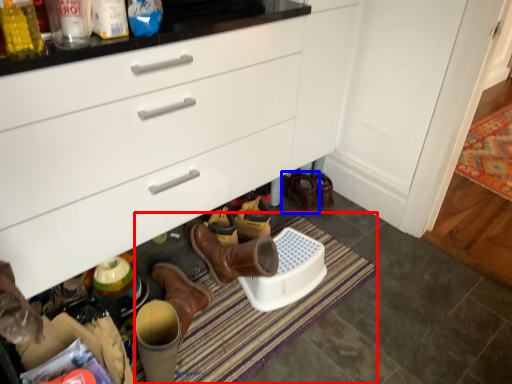
Question: Which of the following is the farthest to the observer, bath mat (highlighted by a red box) or footwear (highlighted by a blue box)?

Choices:
 (A) bath mat
 (B) footwear

Answer: (B)